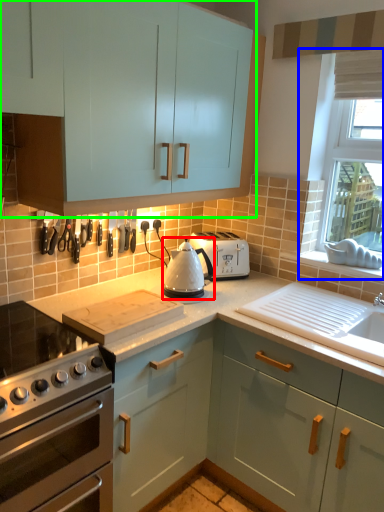
Question: Which object is the closest to the kitchen appliance (highlighted by a red box)? Choose among these: window (highlighted by a blue box) or cabinetry (highlighted by a green box).

Choices:
 (A) window
 (B) cabinetry

Answer: (B)